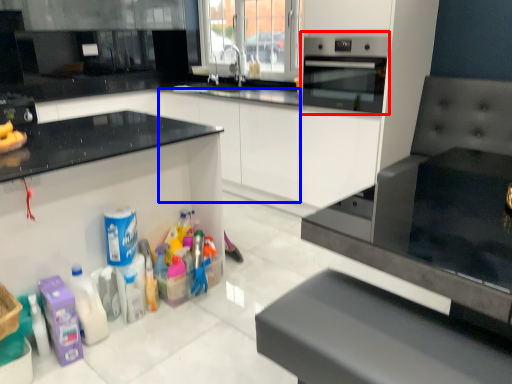
Question: Which of the following is the farthest to the observer, home appliance (highlighted by a red box) or cabinetry (highlighted by a blue box)?

Choices:
 (A) home appliance
 (B) cabinetry

Answer: (B)